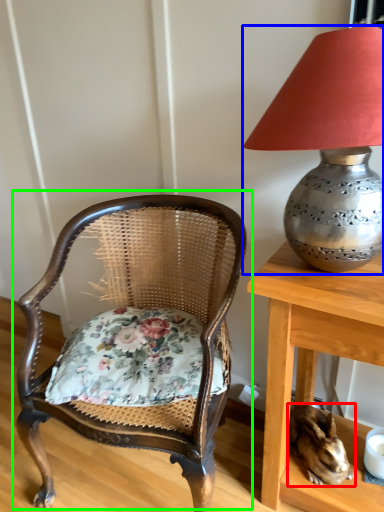
Question: Which is nearer to the rabbit (highlighted by a red box)? lamp (highlighted by a blue box) or chair (highlighted by a green box).

Choices:
 (A) lamp
 (B) chair

Answer: (B)